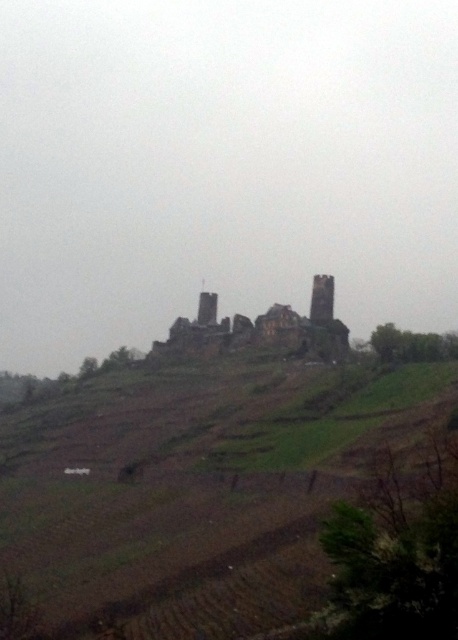
Question: Which object appears closest to the camera in this image?

Choices:
 (A) rusty stone castle at center
 (B) brown earthy hillside at center
 (C) brown stone tower at center

Answer: (B)

Question: Which object is closer to the camera taking this photo?

Choices:
 (A) brown stone tower at center
 (B) brown earthy hillside at center
 (C) rusty stone castle at center

Answer: (B)

Question: In this image, where is rusty stone castle at center located relative to brown stone tower at center?

Choices:
 (A) above
 (B) below

Answer: (B)

Question: Is brown earthy hillside at center thinner than brown stone tower at center?

Choices:
 (A) yes
 (B) no

Answer: (B)

Question: Considering the real-world distances, which object is closest to the brown stone tower at center?

Choices:
 (A) brown earthy hillside at center
 (B) rusty stone castle at center

Answer: (B)

Question: Is rusty stone castle at center behind brown stone tower at center?

Choices:
 (A) yes
 (B) no

Answer: (B)